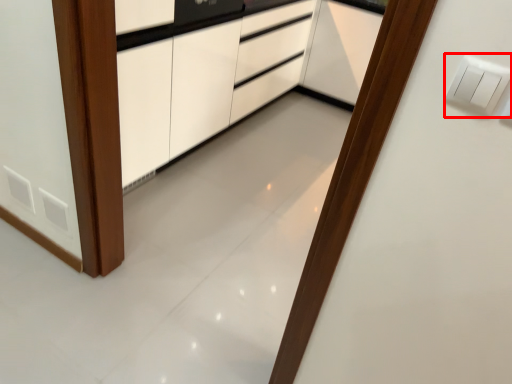
Question: Considering the relative positions of light switch (annotated by the red box) and cabinetry in the image provided, where is light switch (annotated by the red box) located with respect to the staircase?

Choices:
 (A) right
 (B) left

Answer: (A)